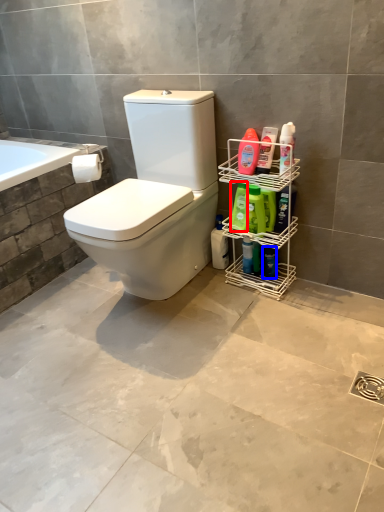
Question: Which of the following is the closest to the observer, cleaning product (highlighted by a red box) or toiletry (highlighted by a blue box)?

Choices:
 (A) cleaning product
 (B) toiletry

Answer: (A)